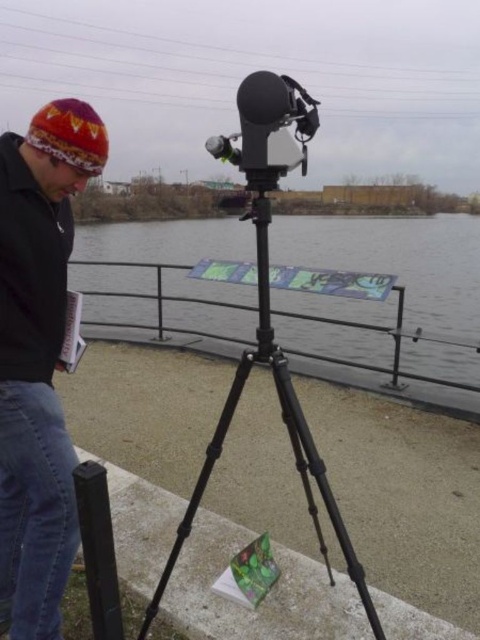
Question: Is knitted woolen hat at upper left to the left of matte black video camera at center from the viewer's perspective?

Choices:
 (A) no
 (B) yes

Answer: (B)

Question: Which point is farther from the camera taking this photo?

Choices:
 (A) (444, 301)
 (B) (8, 397)
 (C) (279, 392)

Answer: (A)

Question: Can you confirm if black matte tripod at center is positioned to the right of matte black video camera at center?

Choices:
 (A) yes
 (B) no

Answer: (B)

Question: Which point appears closest to the camera in this image?

Choices:
 (A) (57, 202)
 (B) (244, 172)
 (C) (299, 301)
 (D) (228, 408)

Answer: (B)

Question: Considering the real-world distances, which object is farthest from the knitted woolen hat at upper left?

Choices:
 (A) matte black video camera at center
 (B) transparent plastic water at center

Answer: (B)

Question: Can you confirm if transparent plastic water at center is positioned to the left of knitted woolen hat at upper left?

Choices:
 (A) yes
 (B) no

Answer: (A)